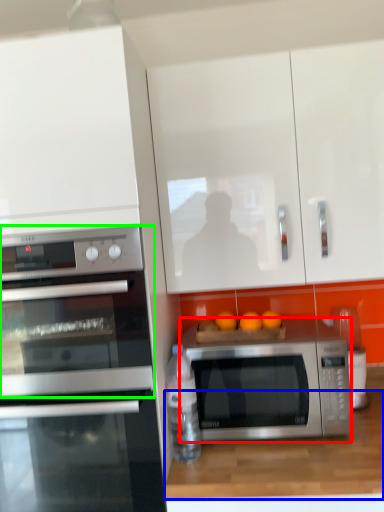
Question: Based on their relative distances, which object is farther from microwave oven (highlighted by a red box)? Choose from counter top (highlighted by a blue box) and microwave oven (highlighted by a green box).

Choices:
 (A) counter top
 (B) microwave oven

Answer: (B)